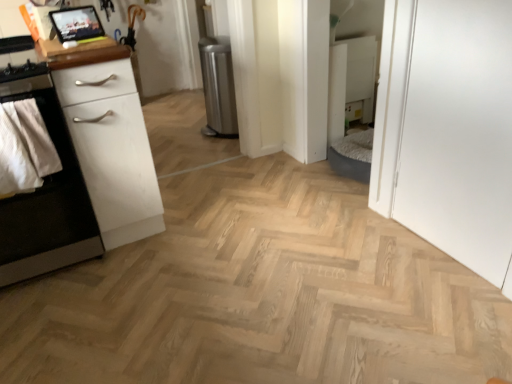
Question: Is matte wood tablet at upper left to the right of white matte cabinet at left from the viewer's perspective?

Choices:
 (A) yes
 (B) no

Answer: (A)

Question: Is matte wood tablet at upper left oriented towards white matte cabinet at left?

Choices:
 (A) no
 (B) yes

Answer: (A)

Question: Is matte wood tablet at upper left placed right next to white matte cabinet at left?

Choices:
 (A) no
 (B) yes

Answer: (A)

Question: From a real-world perspective, is matte wood tablet at upper left on top of white matte cabinet at left?

Choices:
 (A) no
 (B) yes

Answer: (B)

Question: Is white matte cabinet at left surrounded by matte wood tablet at upper left?

Choices:
 (A) no
 (B) yes

Answer: (A)

Question: From the image's perspective, is white matte chest of drawers at left above or below white matte cabinet at left?

Choices:
 (A) below
 (B) above

Answer: (B)

Question: Looking at their shapes, would you say white matte chest of drawers at left is wider or thinner than white matte cabinet at left?

Choices:
 (A) wide
 (B) thin

Answer: (B)

Question: From a real-world perspective, is white matte chest of drawers at left physically located above or below white matte cabinet at left?

Choices:
 (A) below
 (B) above

Answer: (B)

Question: Would you say white matte chest of drawers at left is to the left or to the right of white matte cabinet at left in the picture?

Choices:
 (A) left
 (B) right

Answer: (B)

Question: In the image, is natural wood floor at center positioned in front of or behind matte wood tablet at upper left?

Choices:
 (A) front
 (B) behind

Answer: (A)

Question: Considering the relative positions of natural wood floor at center and matte wood tablet at upper left in the image provided, is natural wood floor at center to the left or to the right of matte wood tablet at upper left?

Choices:
 (A) left
 (B) right

Answer: (B)

Question: Is natural wood floor at center situated inside matte wood tablet at upper left or outside?

Choices:
 (A) inside
 (B) outside

Answer: (B)

Question: Considering the positions of point (215, 324) and point (81, 59), is point (215, 324) closer or farther from the camera than point (81, 59)?

Choices:
 (A) farther
 (B) closer

Answer: (B)

Question: In terms of width, does natural wood floor at center look wider or thinner when compared to matte black tablet at upper left, which ranks as the 1th appliance in front-to-back order?

Choices:
 (A) wide
 (B) thin

Answer: (A)

Question: Considering the positions of point (225, 178) and point (71, 19), is point (225, 178) closer or farther from the camera than point (71, 19)?

Choices:
 (A) closer
 (B) farther

Answer: (B)